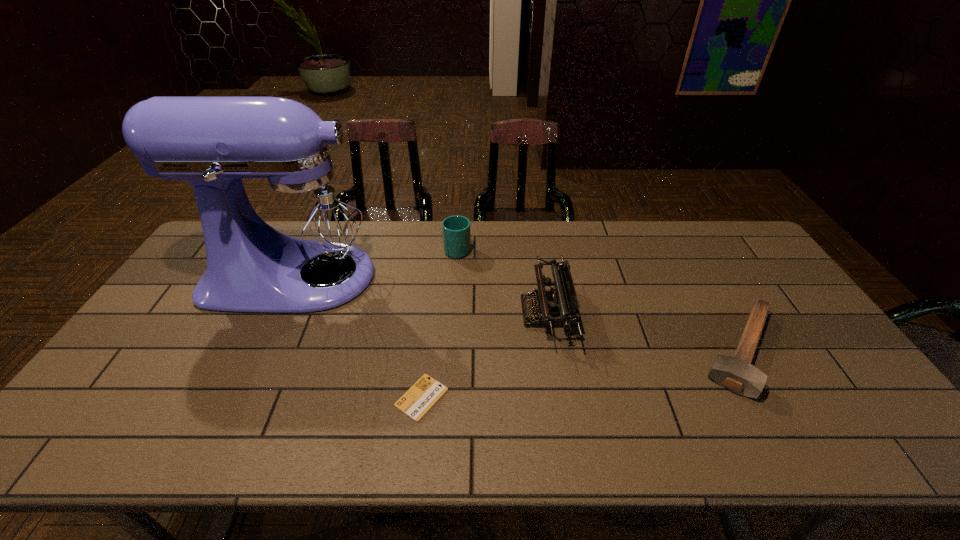
Locate an element on the screen. Image resolution: width=960 pixels, height=540 pixels. vacant position located on the typing side of the typewriter is located at coordinates (464, 312).

The width and height of the screenshot is (960, 540). Find the location of `vacant point located 0.080m on the typing side of the typewriter`. vacant point located 0.080m on the typing side of the typewriter is located at coordinates (494, 312).

I want to click on vacant space located on the typing side of the typewriter, so click(488, 312).

Locate an element on the screen. vacant region located 0.080m on the back of the fourth tallest object is located at coordinates (708, 290).

This screenshot has width=960, height=540. Identify the location of free space located 0.110m on the left of the shortest object. (350, 397).

This screenshot has width=960, height=540. I want to click on mixer positioned at the far edge, so click(x=296, y=239).

Find the location of a particular element. This screenshot has width=960, height=540. cup that is at the far edge is located at coordinates (456, 231).

Where is `object located at the near edge`? This screenshot has width=960, height=540. object located at the near edge is located at coordinates pyautogui.click(x=418, y=400).

At what (x,y) coordinates should I click in order to perform the action: click on object located in the left edge section of the desktop. Please return your answer as a coordinate pair (x, y). The height and width of the screenshot is (540, 960). Looking at the image, I should click on (296, 239).

At what (x,y) coordinates should I click in order to perform the action: click on object located at the right edge. Please return your answer as a coordinate pair (x, y). The width and height of the screenshot is (960, 540). Looking at the image, I should click on (737, 374).